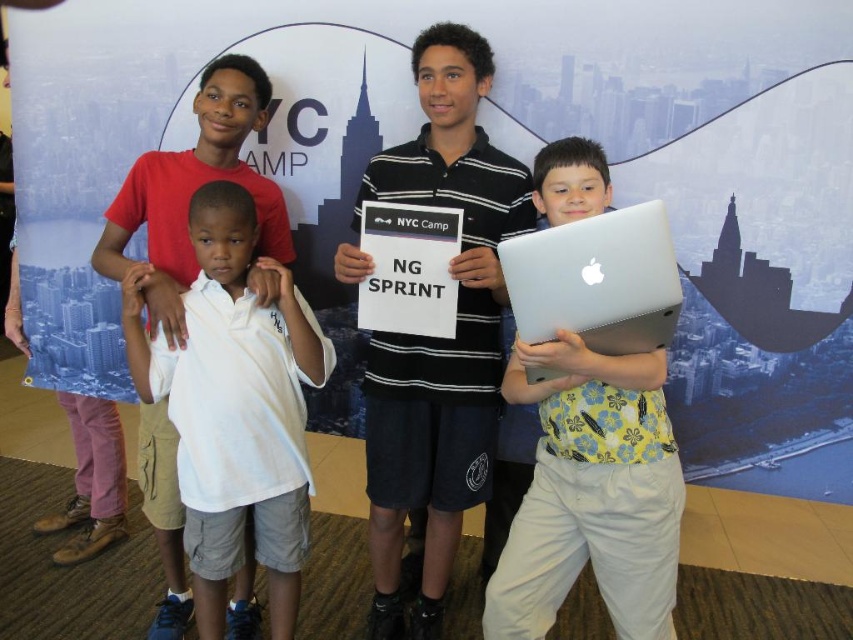
You are a photographer trying to capture a closeup of the black striped polo shirt at center and the white cotton shirt at center. Which one should you focus on if you want to photograph the one that is higher in the frame?

The black striped polo shirt at center is above the white cotton shirt at center, so you should focus on the black striped polo shirt at center to capture the one higher in the frame.

You are organizing a photo shoot and need to ensure that the black striped polo shirt at center and the silver metallic laptop at right are both visible in the frame. Based on their heights, which object will appear taller in the final photo?

The black striped polo shirt at center is taller than the silver metallic laptop at right, so it will appear taller in the final photo.

Consider the image. You are a photographer trying to arrange the group for a photo shoot. You need to position the black striped polo shirt at center and the white cotton shirt at center so that they are aligned with the Empire State Building in the background. Which of the two should be placed to the left to ensure proper alignment with the landmark?

The white cotton shirt at center should be placed to the left since the black striped polo shirt at center is already positioned to its right, aligning them with the Empire State Building in the background.